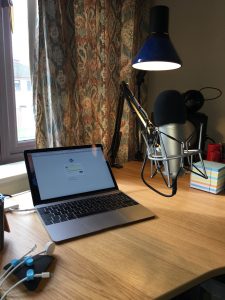
Identify the location of laptop screen. The height and width of the screenshot is (300, 225). (49, 179).